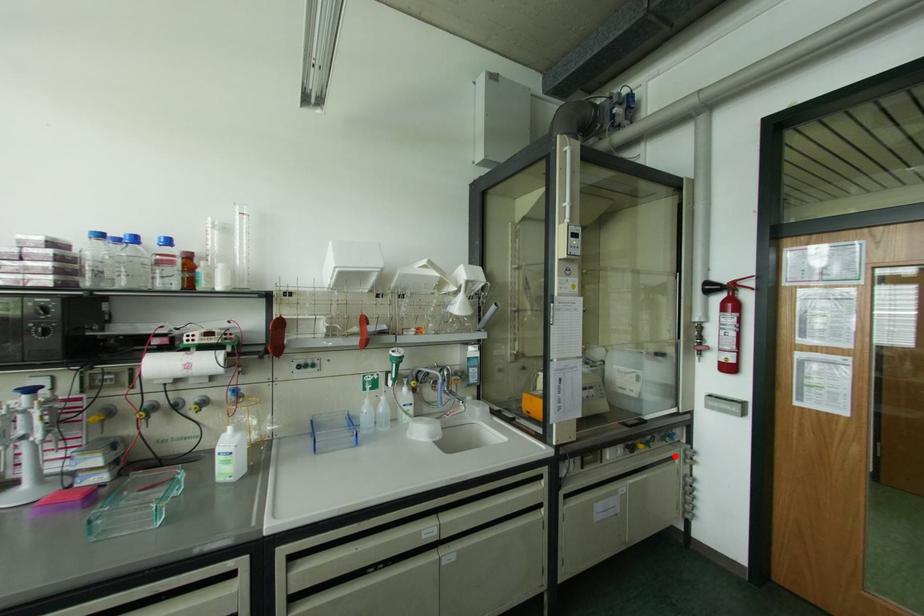
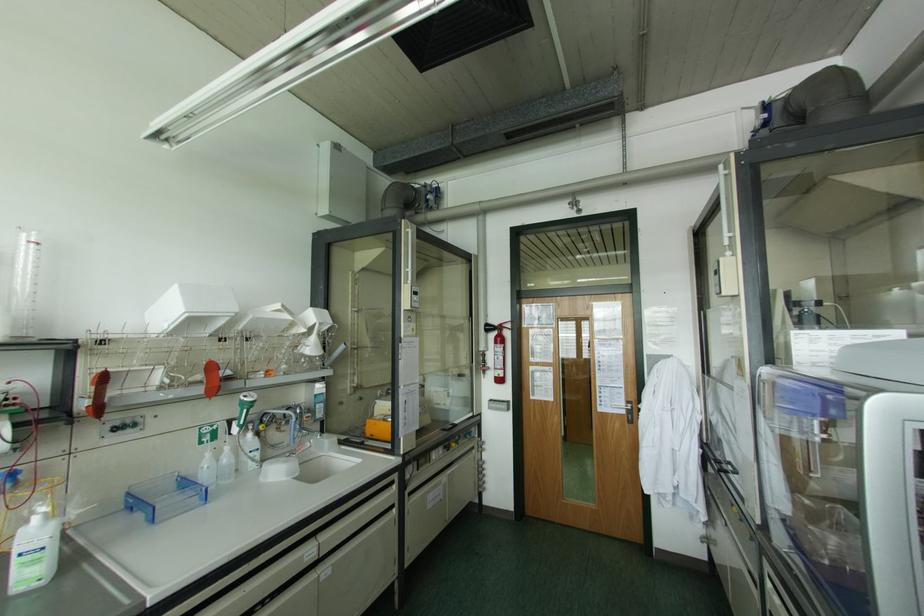
In the second image, find the point that corresponds to the highlighted location in the first image.

(472, 448)